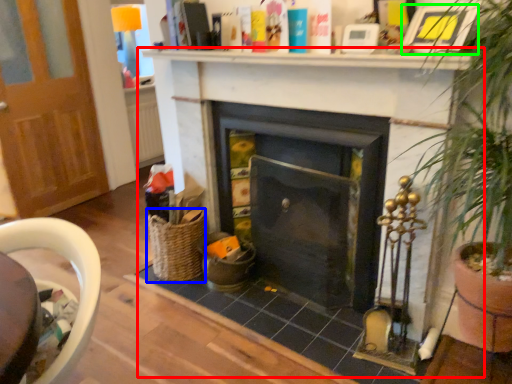
Question: Which is farther away from fireplace (highlighted by a red box)? basket (highlighted by a blue box) or picture frame (highlighted by a green box)?

Choices:
 (A) basket
 (B) picture frame

Answer: (B)